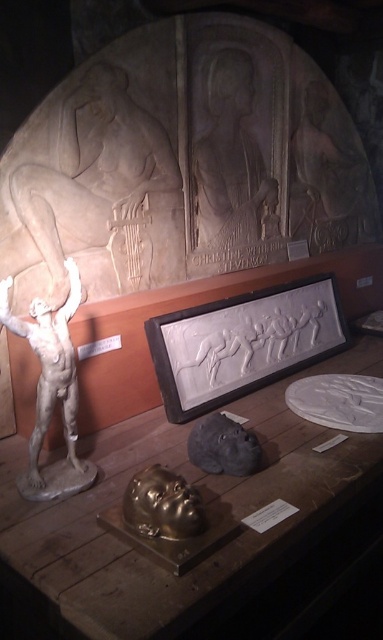
Does point (232, 403) come in front of point (211, 120)?

Yes.

In the scene shown: How much distance is there between wooden table at center and matte stone relief at center?

A distance of 1.14 meters exists between wooden table at center and matte stone relief at center.

Between point (134, 598) and point (211, 104), which one is positioned behind?

The point (211, 104) is more distant.

Find the location of a particular element. The width and height of the screenshot is (383, 640). wooden table at center is located at coordinates (207, 515).

Is light beige stone relief at upper center thinner than white marble statue at left?

In fact, light beige stone relief at upper center might be wider than white marble statue at left.

Is point (42, 157) positioned after point (60, 321)?

Yes, it is.

The height and width of the screenshot is (640, 383). Identify the location of light beige stone relief at upper center. (88, 186).

Can you confirm if wooden table at center is positioned below white marble statue at left?

Correct, wooden table at center is located below white marble statue at left.

How distant is wooden table at center from white marble statue at left?

The distance of wooden table at center from white marble statue at left is 19.33 inches.

Image resolution: width=383 pixels, height=640 pixels. Find the location of `wooden table at center`. wooden table at center is located at coordinates (207, 515).

Image resolution: width=383 pixels, height=640 pixels. What are the coordinates of `wooden table at center` in the screenshot? It's located at (207, 515).